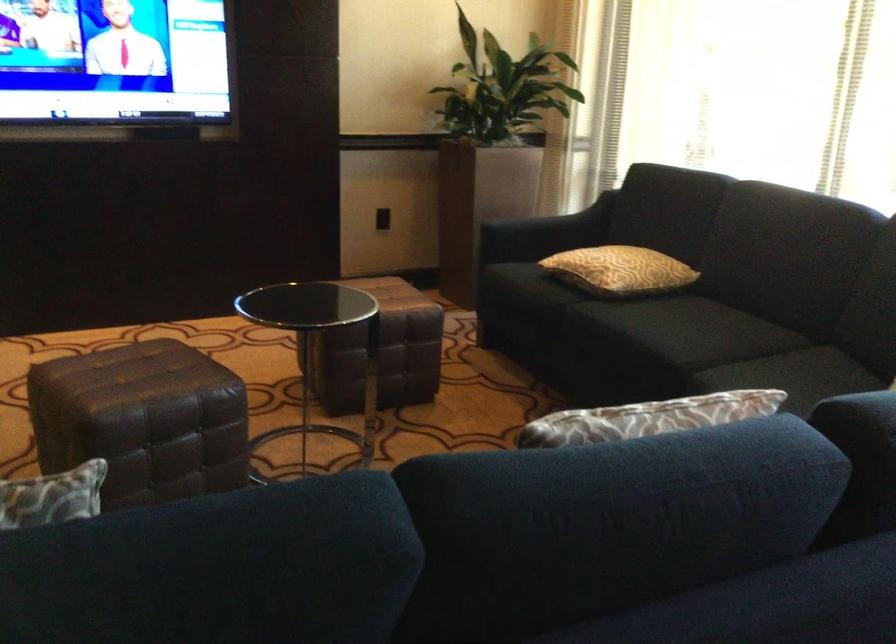
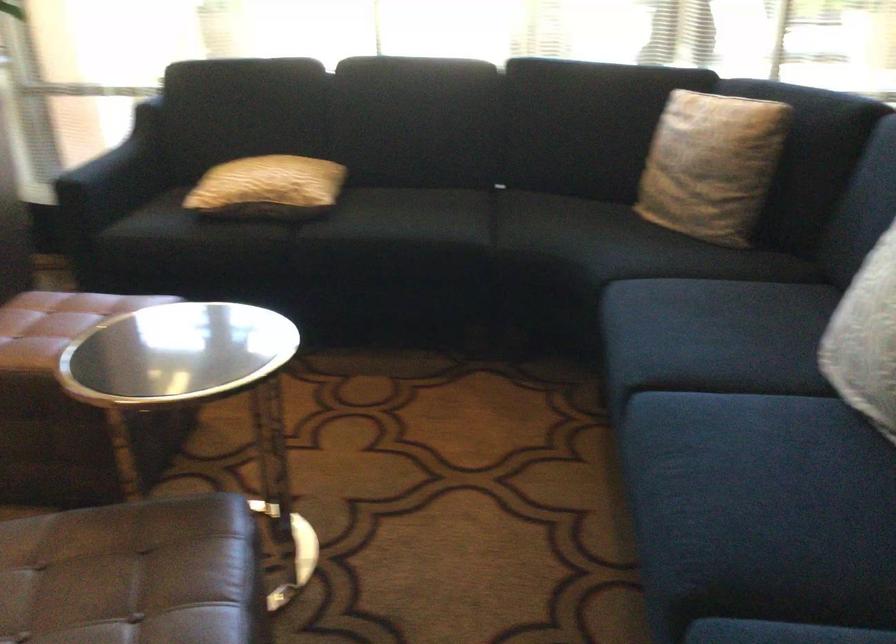
In the second image, find the point that corresponds to point 529,230 in the first image.

(115, 176)